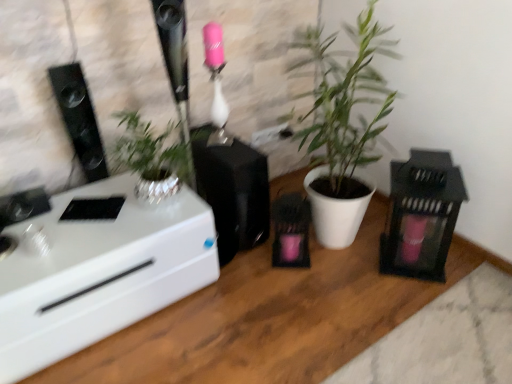
Question: Considering the positions of point (64, 117) and point (307, 57), is point (64, 117) closer or farther from the camera than point (307, 57)?

Choices:
 (A) farther
 (B) closer

Answer: (B)

Question: Do you think black glossy speaker at left is within white matte plant pot at center, or outside of it?

Choices:
 (A) inside
 (B) outside

Answer: (B)

Question: Based on their relative distances, which object is nearer to the white matte plant pot at center?

Choices:
 (A) white glossy desk at left
 (B) black matte speaker at center, which is counted as the first appliance, starting from the left
 (C) black matte lantern at right, which is the 2th appliance from left to right
 (D) black glossy speaker at left

Answer: (C)

Question: Which of these objects is positioned closest to the black matte lantern at right, which is the 2th appliance from left to right?

Choices:
 (A) black matte speaker at center, which is counted as the first appliance, starting from the left
 (B) white glossy desk at left
 (C) white matte plant pot at center
 (D) black glossy speaker at left

Answer: (C)